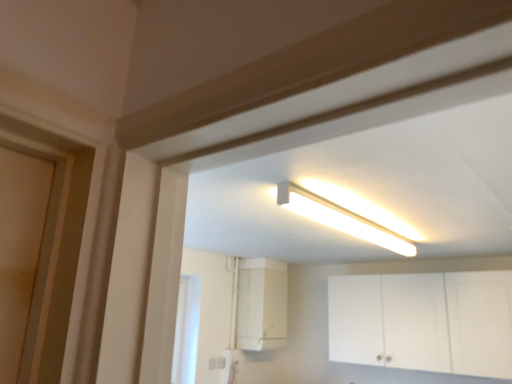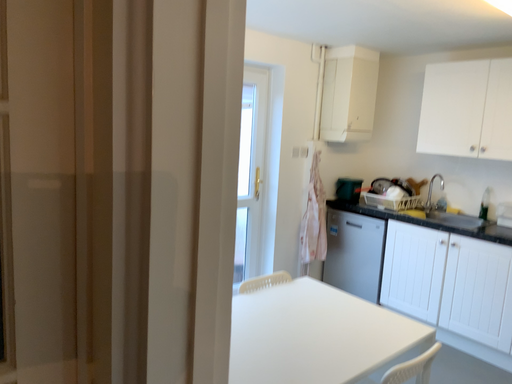
Question: Which way did the camera rotate in the video?

Choices:
 (A) rotated left
 (B) rotated right

Answer: (A)